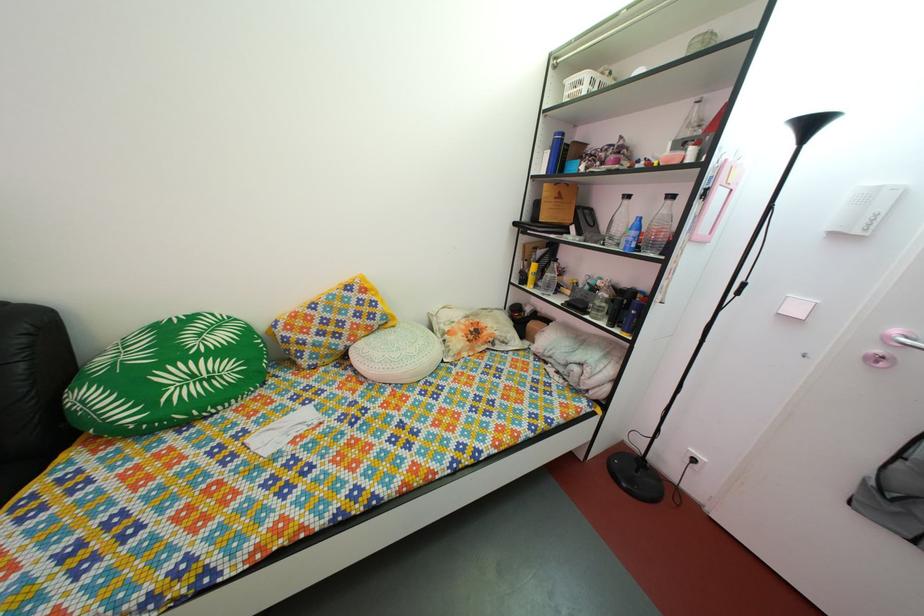
The image size is (924, 616). I want to click on green leaf pillow, so click(166, 376).